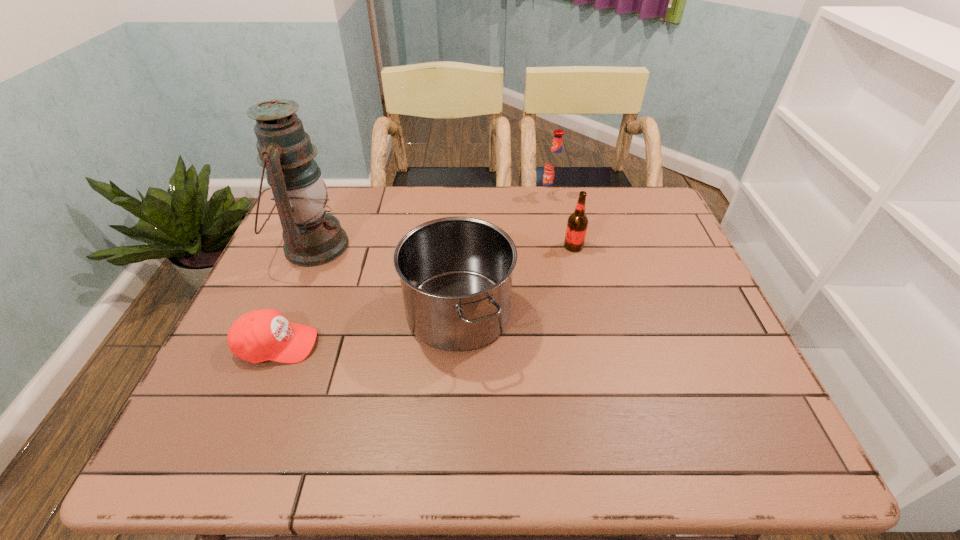
Locate an element on the screen. Image resolution: width=960 pixels, height=540 pixels. free space located 0.360m on the front panel of the shortest object is located at coordinates (475, 345).

Where is `oil lamp that is at the far edge`? The image size is (960, 540). oil lamp that is at the far edge is located at coordinates (312, 237).

Locate an element on the screen. root beer that is at the far edge is located at coordinates (554, 167).

You are a GUI agent. You are given a task and a screenshot of the screen. Output one action in this format:
    pyautogui.click(x=<x>, y=<y>)
    Task: Click on the oil lamp present at the left edge
    Image resolution: width=960 pixels, height=540 pixels.
    Given the screenshot: What is the action you would take?
    312,237

Locate an element on the screen. baseball cap present at the left edge is located at coordinates point(260,335).

Identify the location of object present at the far left corner. (312, 237).

This screenshot has height=540, width=960. I want to click on free space at the far edge of the desktop, so click(x=414, y=196).

Identify the location of vacant area at the near edge of the desktop. (313, 426).

In the image, there is a desktop. Where is `vacant space at the left edge`? The height and width of the screenshot is (540, 960). vacant space at the left edge is located at coordinates (287, 280).

This screenshot has height=540, width=960. In the image, there is a desktop. Identify the location of free region at the right edge. (697, 278).